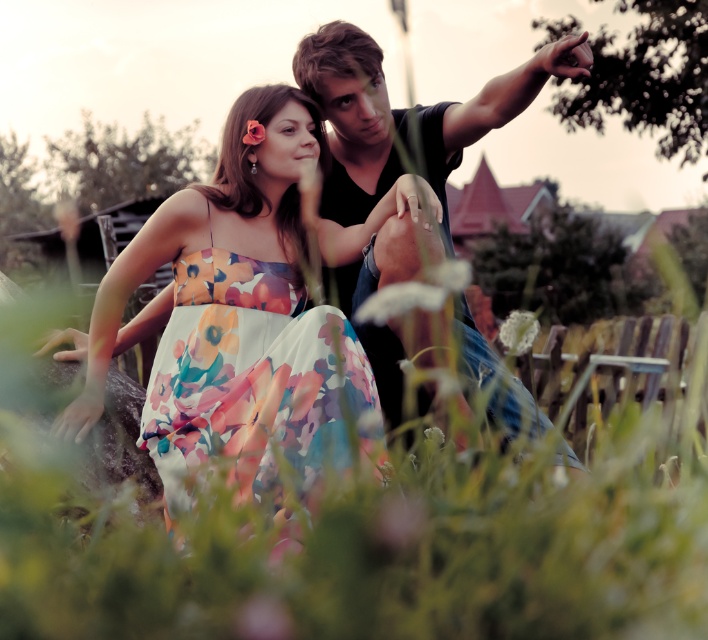
You are standing in the outdoor scene and want to walk towards the two points marked as point (x=523, y=316) and point (x=253, y=122). Which point will you reach first?

Point (x=523, y=316) is closer to you than point (x=253, y=122), so you will reach point (x=523, y=316) first.

You are a photographer trying to capture a closeup of the white matte flower at lower center and the soft pink petal at center. Which one should you focus on first if you want to ensure both are in focus without moving the camera?

You should focus on the white matte flower at lower center first because it is positioned to the right of the soft pink petal at center, allowing for better depth of field coverage when keeping both in focus.